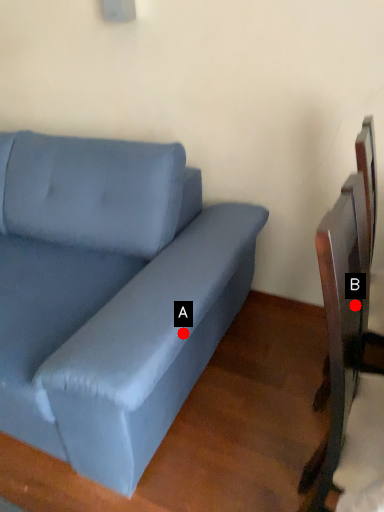
Question: Two points are circled on the image, labeled by A and B beside each circle. Which point is farther to the camera?

Choices:
 (A) A is further
 (B) B is further

Answer: (A)